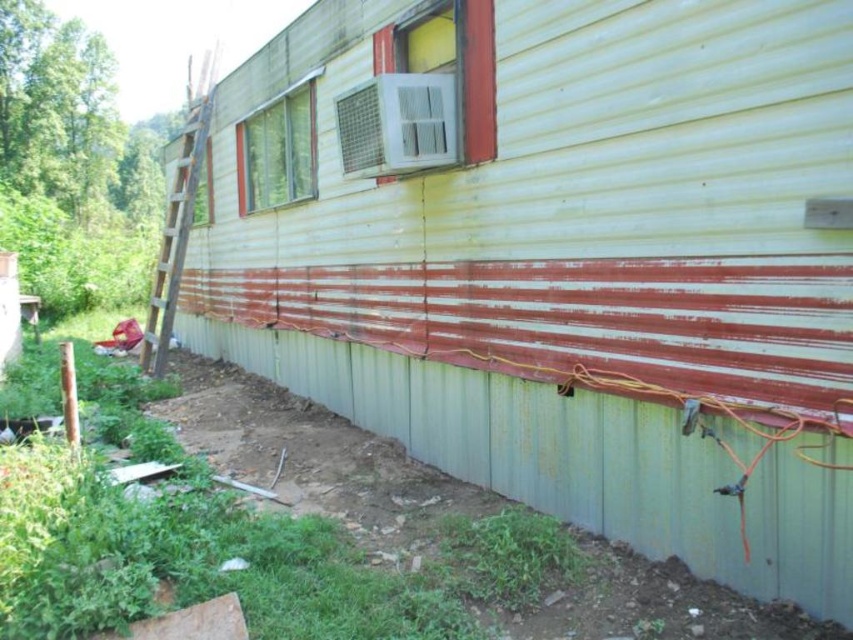
Can you confirm if wooden at left is positioned below clear glass window at upper center?

No, wooden at left is not below clear glass window at upper center.

Who is more forward, (201, 65) or (312, 145)?

Positioned in front is point (312, 145).

Which is behind, point (180, 275) or point (283, 120)?

The point (180, 275) is behind.

This screenshot has width=853, height=640. In order to click on wooden at left in this screenshot , I will do `click(178, 214)`.